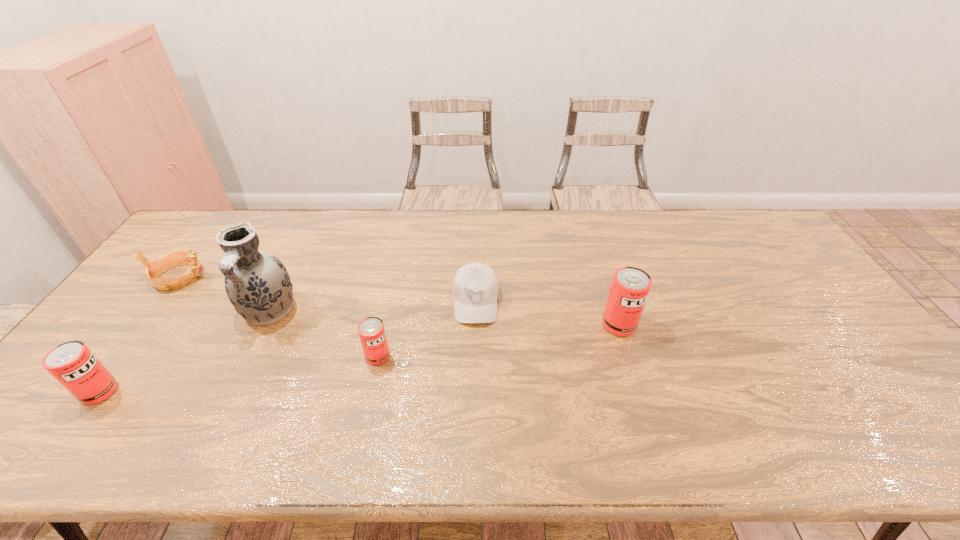
You are a GUI agent. You are given a task and a screenshot of the screen. Output one action in this format:
    pyautogui.click(x=<x>, y=<y>)
    Task: Click on the leftmost can
    
    Given the screenshot: What is the action you would take?
    pyautogui.click(x=72, y=364)

At what (x,y) coordinates should I click in order to perform the action: click on the nearest object. Please return your answer as a coordinate pair (x, y). Image resolution: width=960 pixels, height=540 pixels. Looking at the image, I should click on (72, 364).

At what (x,y) coordinates should I click in order to perform the action: click on the shortest can. Please return your answer as a coordinate pair (x, y). This screenshot has width=960, height=540. Looking at the image, I should click on (371, 330).

Identify the location of the second nearest can. (371, 330).

At what (x,y) coordinates should I click in order to perform the action: click on the rightmost can. Please return your answer as a coordinate pair (x, y). Looking at the image, I should click on (630, 286).

The image size is (960, 540). Identify the location of the second tallest object. (630, 286).

Identify the location of the fourth object from right to left. The width and height of the screenshot is (960, 540). [257, 284].

Where is `vase`? Image resolution: width=960 pixels, height=540 pixels. vase is located at coordinates (x=257, y=284).

Locate an element on the screen. Image resolution: width=960 pixels, height=540 pixels. baseball cap is located at coordinates (475, 288).

Find the location of `tiara`. tiara is located at coordinates click(178, 256).